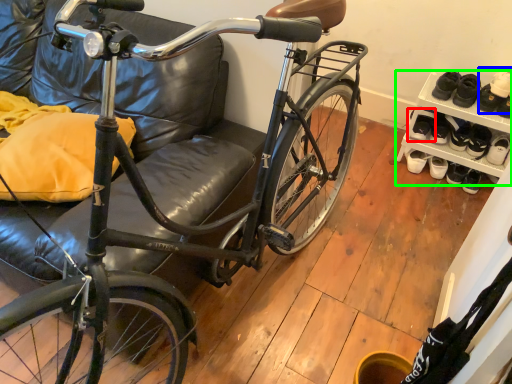
Question: Which object is positioned closest to footwear (highlighted by a red box)? Select from shoe (highlighted by a blue box) and shelf (highlighted by a green box).

Choices:
 (A) shoe
 (B) shelf

Answer: (B)